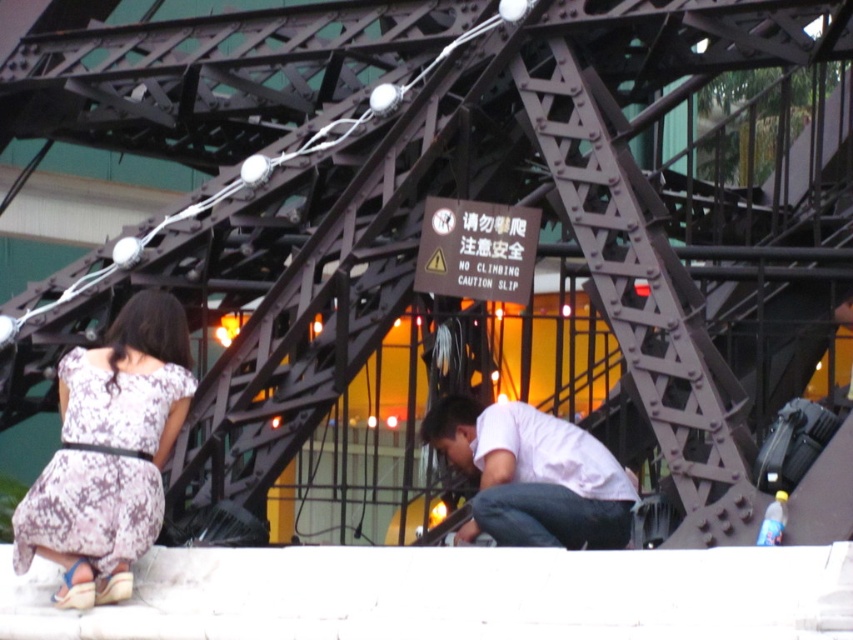
You are standing in the amusement park and see two people wearing different outfits. The floral print fabric dress at lower left and the white matte shirt at lower center. Which one is positioned more to the left side?

The floral print fabric dress at lower left is positioned more to the left side than the white matte shirt at lower center.

From the picture: You are a photographer trying to capture both the floral print fabric dress at lower left and the white matte shirt at lower center in your shot. Which clothing item appears narrower in the photo?

The floral print fabric dress at lower left appears narrower in the photo because it is thinner than the white matte shirt at lower center.